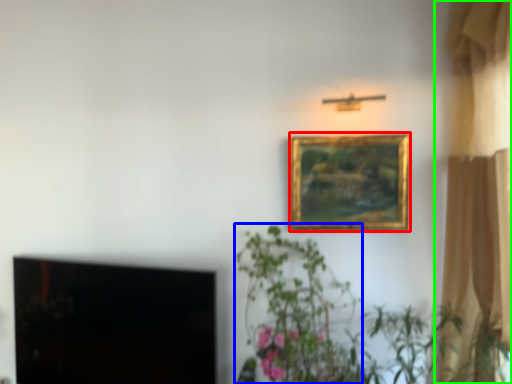
Question: Estimate the real-world distances between objects in this image. Which object is farther from picture frame (highlighted by a red box), plant (highlighted by a blue box) or curtain (highlighted by a green box)?

Choices:
 (A) plant
 (B) curtain

Answer: (B)